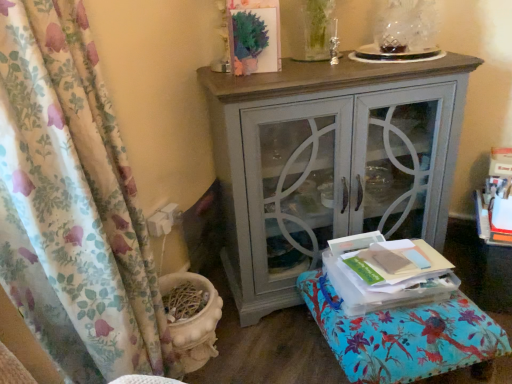
This screenshot has height=384, width=512. Identify the location of empty space that is ontop of floral fabric ottoman at lower right (from a real-world perspective). (393, 312).